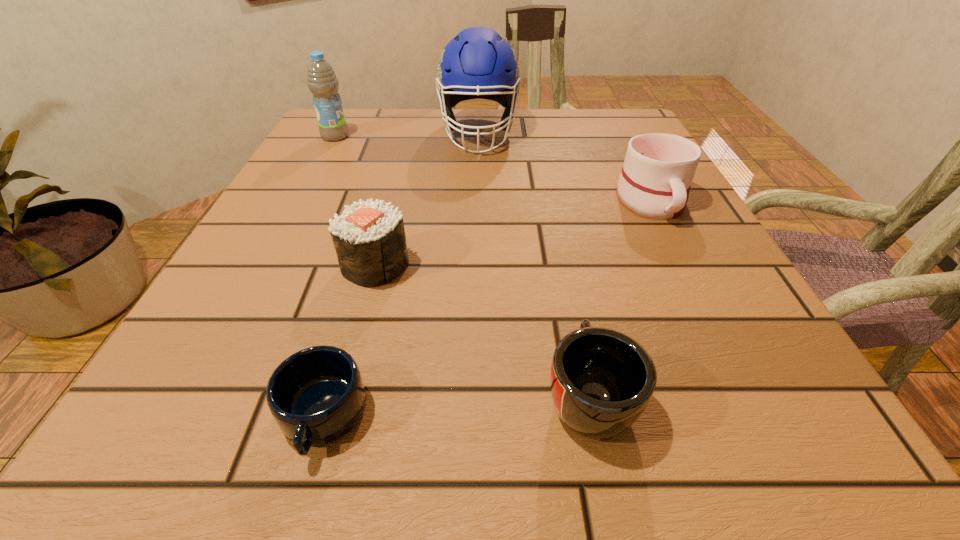
Locate an element on the screen. Image resolution: width=960 pixels, height=540 pixels. football helmet is located at coordinates (478, 63).

Image resolution: width=960 pixels, height=540 pixels. I want to click on the second tallest object, so click(x=322, y=81).

This screenshot has height=540, width=960. Find the location of `water bottle`. water bottle is located at coordinates coord(322,81).

This screenshot has width=960, height=540. In order to click on the tallest mug in this screenshot , I will do `click(658, 170)`.

I want to click on the farthest mug, so click(658, 170).

This screenshot has height=540, width=960. In order to click on sushi in this screenshot , I will do (369, 238).

You are a GUI agent. You are given a task and a screenshot of the screen. Output one action in this format:
    pyautogui.click(x=<x>, y=<y>)
    Task: Click on the second shortest mug
    This screenshot has height=540, width=960.
    Given the screenshot: What is the action you would take?
    pyautogui.click(x=602, y=380)

Find the location of a particular element. the shortest mug is located at coordinates (316, 395).

The image size is (960, 540). Identify the location of the shortest object. (316, 395).

This screenshot has height=540, width=960. Find the location of `free space located on the face guard of the tallest object`. free space located on the face guard of the tallest object is located at coordinates (478, 238).